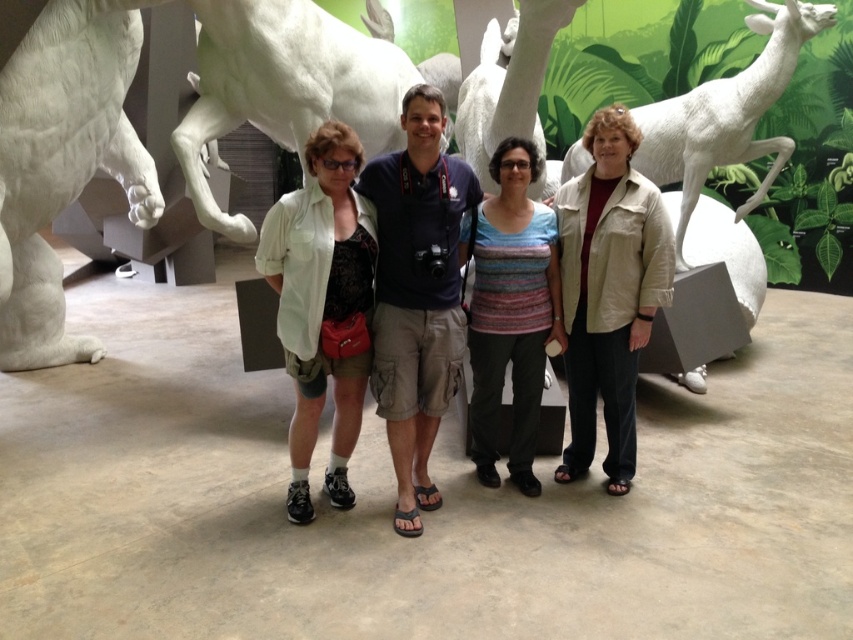
You are standing in the museum and want to take a photo of the beige fabric jacket at center. Where should you position yourself to capture it in the frame?

To capture the beige fabric jacket at center in your photo, position yourself so that the jacket is centered at the point with coordinates approximately 0.456 on the x axis and 0.714 on the y axis.